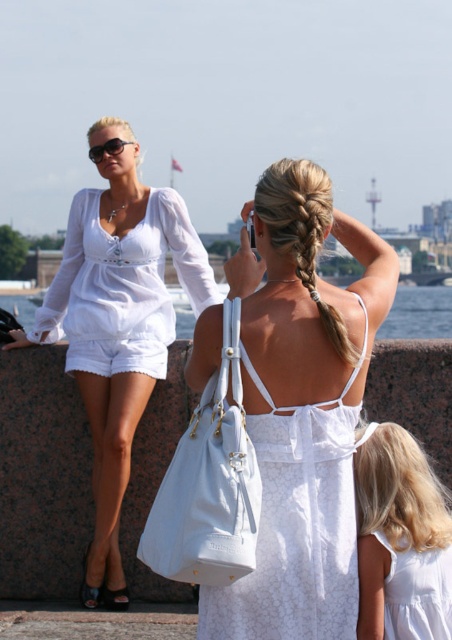
This screenshot has width=452, height=640. What do you see at coordinates (301, 408) in the screenshot?
I see `white fabric dress at center` at bounding box center [301, 408].

Which is below, white fabric dress at center or white lace dress at center?

Positioned lower is white lace dress at center.

Is point (307, 323) positioned before point (422, 609)?

No, it is behind (422, 609).

You are a GUI agent. You are given a task and a screenshot of the screen. Output one action in this format:
    pyautogui.click(x=<x>, y=<y>)
    Task: Click on the white fabric dress at center
    
    Given the screenshot: What is the action you would take?
    pyautogui.click(x=301, y=408)

Describe the element at coordinates (301, 408) in the screenshot. This screenshot has width=452, height=640. I see `white fabric dress at center` at that location.

Is point (314, 516) farther from viewer compared to point (102, 392)?

No, it is not.

You are a GUI agent. You are given a task and a screenshot of the screen. Output one action in this format:
    pyautogui.click(x=<x>, y=<y>)
    Task: Click on the white fabric dress at center
    This screenshot has width=452, height=640.
    Given the screenshot: What is the action you would take?
    pyautogui.click(x=301, y=408)

Is point (103, 556) closer to viewer compared to point (413, 317)?

Yes, it is in front of point (413, 317).

Between matte white blouse at center and clear water at center, which one has less height?

Standing shorter between the two is clear water at center.

The height and width of the screenshot is (640, 452). Identify the location of matte white blouse at center. (117, 323).